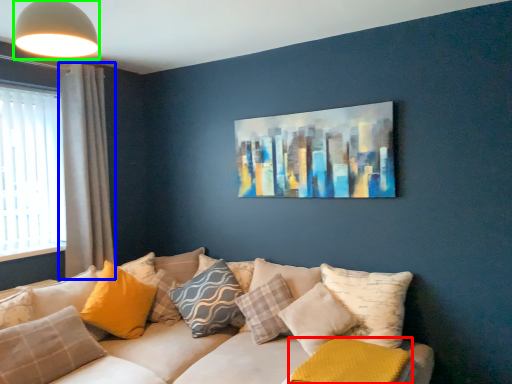
Question: Which is farther away from pillow (highlighted by a red box)? curtain (highlighted by a blue box) or light fixture (highlighted by a green box)?

Choices:
 (A) curtain
 (B) light fixture

Answer: (A)